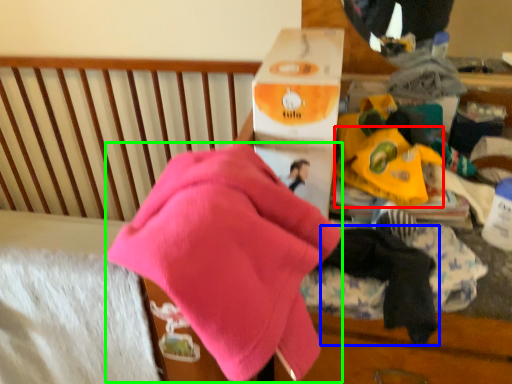
Question: Based on their relative distances, which object is farther from toy (highlighted by a red box)? Choose from baby clothe (highlighted by a blue box) and underclothes (highlighted by a green box).

Choices:
 (A) baby clothe
 (B) underclothes

Answer: (B)